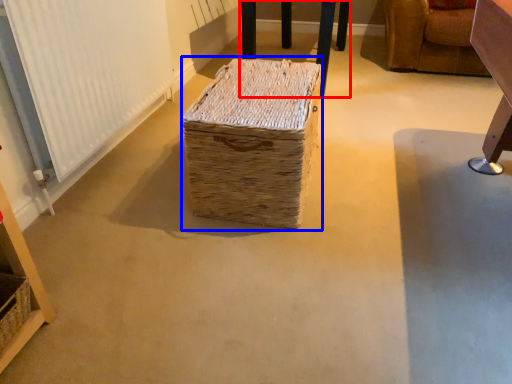
Question: Which object is closer to the camera taking this photo, furniture (highlighted by a red box) or storage box (highlighted by a blue box)?

Choices:
 (A) furniture
 (B) storage box

Answer: (B)